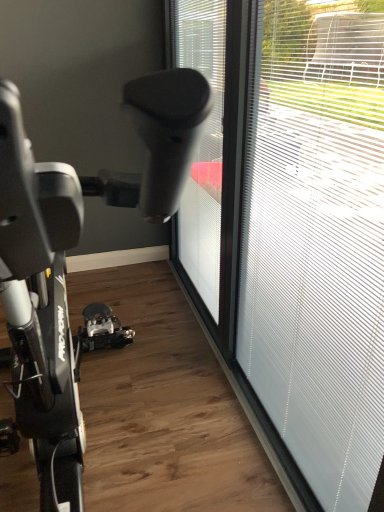
Question: Are transparent glass window at right, the first window from the right, and transparent plastic window at center, the first window in the left-to-right sequence, far apart?

Choices:
 (A) yes
 (B) no

Answer: (B)

Question: Is transparent plastic window at center, placed as the second window when sorted from right to left, at the back of transparent glass window at right, placed as the second window when sorted from left to right?

Choices:
 (A) yes
 (B) no

Answer: (B)

Question: Is transparent plastic window at center, placed as the second window when sorted from right to left, a part of transparent glass window at right, placed as the second window when sorted from left to right?

Choices:
 (A) yes
 (B) no

Answer: (B)

Question: Is transparent glass window at right, the first window from the right, positioned behind transparent plastic window at center, the first window in the left-to-right sequence?

Choices:
 (A) no
 (B) yes

Answer: (A)

Question: Does transparent glass window at right, the first window from the right, have a smaller size compared to transparent plastic window at center, placed as the second window when sorted from right to left?

Choices:
 (A) no
 (B) yes

Answer: (B)

Question: Is transparent glass window at right, placed as the second window when sorted from left to right, thinner than transparent plastic window at center, the first window in the left-to-right sequence?

Choices:
 (A) yes
 (B) no

Answer: (A)

Question: From the image's perspective, is transparent plastic window at center, placed as the second window when sorted from right to left, beneath transparent glass window at right, the first window from the right?

Choices:
 (A) no
 (B) yes

Answer: (A)

Question: From a real-world perspective, is transparent plastic window at center, placed as the second window when sorted from right to left, physically above transparent glass window at right, the first window from the right?

Choices:
 (A) no
 (B) yes

Answer: (B)

Question: Would you consider transparent plastic window at center, placed as the second window when sorted from right to left, to be distant from transparent glass window at right, placed as the second window when sorted from left to right?

Choices:
 (A) yes
 (B) no

Answer: (B)

Question: Can you confirm if transparent plastic window at center, placed as the second window when sorted from right to left, is taller than transparent glass window at right, placed as the second window when sorted from left to right?

Choices:
 (A) yes
 (B) no

Answer: (A)

Question: Is transparent glass window at right, the first window from the right, a part of transparent plastic window at center, the first window in the left-to-right sequence?

Choices:
 (A) yes
 (B) no

Answer: (B)

Question: Considering the relative positions of transparent plastic window at center, placed as the second window when sorted from right to left, and transparent glass window at right, placed as the second window when sorted from left to right, in the image provided, is transparent plastic window at center, placed as the second window when sorted from right to left, to the left of transparent glass window at right, placed as the second window when sorted from left to right, from the viewer's perspective?

Choices:
 (A) no
 (B) yes

Answer: (B)

Question: From their relative heights in the image, would you say transparent glass window at right, placed as the second window when sorted from left to right, is taller or shorter than transparent plastic window at center, placed as the second window when sorted from right to left?

Choices:
 (A) tall
 (B) short

Answer: (B)